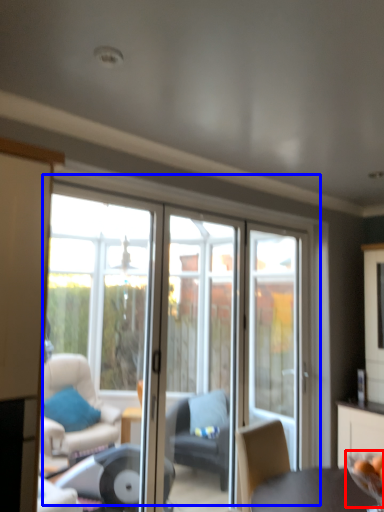
Question: Which object is closer to the camera taking this photo, glass bowl (highlighted by a red box) or door (highlighted by a blue box)?

Choices:
 (A) glass bowl
 (B) door

Answer: (A)